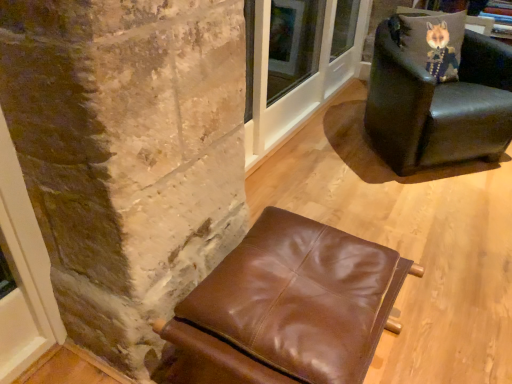
The width and height of the screenshot is (512, 384). What are the coordinates of `velvet fox pillow at upper right` in the screenshot? It's located at (434, 42).

The width and height of the screenshot is (512, 384). Find the location of `brown leather ottoman at lower center, the 2th chair in the top-to-bottom sequence`. brown leather ottoman at lower center, the 2th chair in the top-to-bottom sequence is located at coordinates (287, 308).

Where is `velvet fox pillow at upper right`? This screenshot has height=384, width=512. velvet fox pillow at upper right is located at coordinates (434, 42).

Locate an element on the screen. pillow behind the leather armchair at upper right, the 2th chair from the left is located at coordinates (434, 42).

Is leather armchair at upper right, the 1th chair viewed from the top, smaller than velvet fox pillow at upper right?

Actually, leather armchair at upper right, the 1th chair viewed from the top, might be larger than velvet fox pillow at upper right.

Does leather armchair at upper right, the 2th chair from the left, appear on the right side of velvet fox pillow at upper right?

Yes, leather armchair at upper right, the 2th chair from the left, is to the right of velvet fox pillow at upper right.

Considering the sizes of objects leather armchair at upper right, the second chair ordered from the bottom, and velvet fox pillow at upper right in the image provided, who is shorter, leather armchair at upper right, the second chair ordered from the bottom, or velvet fox pillow at upper right?

With less height is velvet fox pillow at upper right.

From the image's perspective, is velvet fox pillow at upper right located above or below leather armchair at upper right, the 1th chair viewed from the top?

Clearly, from the image's perspective, velvet fox pillow at upper right is above leather armchair at upper right, the 1th chair viewed from the top.

Is velvet fox pillow at upper right taller or shorter than leather armchair at upper right, marked as the first chair in a back-to-front arrangement?

velvet fox pillow at upper right is shorter than leather armchair at upper right, marked as the first chair in a back-to-front arrangement.

Do you think velvet fox pillow at upper right is within leather armchair at upper right, marked as the first chair in a back-to-front arrangement, or outside of it?

velvet fox pillow at upper right is spatially positioned inside leather armchair at upper right, marked as the first chair in a back-to-front arrangement.

Is brown leather ottoman at lower center, which appears as the 1th chair when ordered from the bottom, positioned far away from leather armchair at upper right, the second chair ordered from the bottom?

Yes, brown leather ottoman at lower center, which appears as the 1th chair when ordered from the bottom, and leather armchair at upper right, the second chair ordered from the bottom, are located far from each other.

Is brown leather ottoman at lower center, arranged as the 1th chair when viewed from the front, not within leather armchair at upper right, the 1th chair viewed from the top?

That's correct, brown leather ottoman at lower center, arranged as the 1th chair when viewed from the front, is outside of leather armchair at upper right, the 1th chair viewed from the top.

From the image's perspective, is brown leather ottoman at lower center, arranged as the 1th chair when viewed from the front, positioned above or below leather armchair at upper right, marked as the 2th chair in a front-to-back arrangement?

Clearly, from the image's perspective, brown leather ottoman at lower center, arranged as the 1th chair when viewed from the front, is below leather armchair at upper right, marked as the 2th chair in a front-to-back arrangement.

From their relative heights in the image, would you say brown leather ottoman at lower center, the second chair positioned from the back, is taller or shorter than leather armchair at upper right, the second chair ordered from the bottom?

Clearly, brown leather ottoman at lower center, the second chair positioned from the back, is shorter compared to leather armchair at upper right, the second chair ordered from the bottom.

Does point (486, 116) come farther from viewer compared to point (275, 348)?

Yes, it is.

Looking at this image, would you say leather armchair at upper right, marked as the first chair in a back-to-front arrangement, is a long distance from brown leather ottoman at lower center, acting as the second chair starting from the right?

Absolutely, leather armchair at upper right, marked as the first chair in a back-to-front arrangement, is distant from brown leather ottoman at lower center, acting as the second chair starting from the right.

Is brown leather ottoman at lower center, acting as the second chair starting from the right, bigger than velvet fox pillow at upper right?

Yes.

From a real-world perspective, which is physically above, brown leather ottoman at lower center, the second chair positioned from the back, or velvet fox pillow at upper right?

From a 3D spatial view, velvet fox pillow at upper right is above.

Based on the photo, is brown leather ottoman at lower center, arranged as the 1th chair when viewed from the front, oriented towards velvet fox pillow at upper right?

No, brown leather ottoman at lower center, arranged as the 1th chair when viewed from the front, is not facing towards velvet fox pillow at upper right.

Does point (408, 48) come closer to viewer compared to point (307, 371)?

No, it is behind (307, 371).

Considering the positions of objects velvet fox pillow at upper right and brown leather ottoman at lower center, the second chair positioned from the back, in the image provided, who is more to the left, velvet fox pillow at upper right or brown leather ottoman at lower center, the second chair positioned from the back,?

brown leather ottoman at lower center, the second chair positioned from the back, is more to the left.

From the image's perspective, who appears lower, velvet fox pillow at upper right or brown leather ottoman at lower center, the 2th chair in the top-to-bottom sequence?

brown leather ottoman at lower center, the 2th chair in the top-to-bottom sequence, from the image's perspective.

Image resolution: width=512 pixels, height=384 pixels. Identify the location of pillow above the leather armchair at upper right, marked as the 2th chair in a front-to-back arrangement (from the image's perspective). (434, 42).

Find the location of `pillow on the left side of leather armchair at upper right, the first chair viewed from the right`. pillow on the left side of leather armchair at upper right, the first chair viewed from the right is located at coordinates (434, 42).

Which object lies nearer to the anchor point velvet fox pillow at upper right, brown leather ottoman at lower center, acting as the second chair starting from the right, or leather armchair at upper right, the 2th chair from the left?

Among the two, leather armchair at upper right, the 2th chair from the left, is located nearer to velvet fox pillow at upper right.

Consider the image. Estimate the real-world distances between objects in this image. Which object is further from leather armchair at upper right, the 1th chair viewed from the top, velvet fox pillow at upper right or brown leather ottoman at lower center, arranged as the 1th chair when viewed from the front?

brown leather ottoman at lower center, arranged as the 1th chair when viewed from the front, is further to leather armchair at upper right, the 1th chair viewed from the top.

Which object lies nearer to the anchor point velvet fox pillow at upper right, leather armchair at upper right, the 2th chair from the left, or brown leather ottoman at lower center, the 2th chair in the top-to-bottom sequence?

leather armchair at upper right, the 2th chair from the left.

Looking at the image, which one is located closer to leather armchair at upper right, marked as the first chair in a back-to-front arrangement, brown leather ottoman at lower center, arranged as the 1th chair when viewed from the front, or velvet fox pillow at upper right?

velvet fox pillow at upper right is closer to leather armchair at upper right, marked as the first chair in a back-to-front arrangement.

From the picture: Estimate the real-world distances between objects in this image. Which object is closer to brown leather ottoman at lower center, the 2th chair in the top-to-bottom sequence, leather armchair at upper right, the first chair viewed from the right, or velvet fox pillow at upper right?

leather armchair at upper right, the first chair viewed from the right, lies closer to brown leather ottoman at lower center, the 2th chair in the top-to-bottom sequence, than the other object.

Considering their positions, is velvet fox pillow at upper right positioned closer to brown leather ottoman at lower center, the first chair in the left-to-right sequence, than leather armchair at upper right, the 2th chair from the left?

Among the two, leather armchair at upper right, the 2th chair from the left, is located nearer to brown leather ottoman at lower center, the first chair in the left-to-right sequence.

This screenshot has width=512, height=384. What are the coordinates of `chair between brown leather ottoman at lower center, the second chair positioned from the back, and velvet fox pillow at upper right from front to back` in the screenshot? It's located at (438, 105).